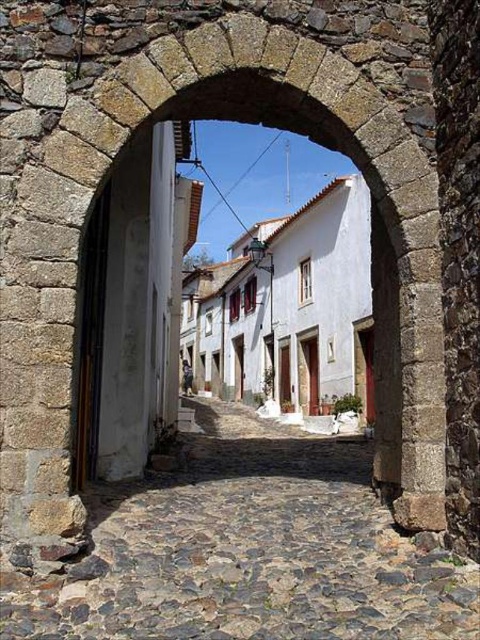
Question: Does cobblestone path at center lie behind white smooth building at center?

Choices:
 (A) no
 (B) yes

Answer: (A)

Question: Does cobblestone path at center have a smaller size compared to white smooth building at center?

Choices:
 (A) yes
 (B) no

Answer: (A)

Question: Which point appears closest to the camera in this image?

Choices:
 (A) (249, 529)
 (B) (328, 262)

Answer: (A)

Question: Which point is closer to the camera taking this photo?

Choices:
 (A) (360, 266)
 (B) (355, 496)

Answer: (B)

Question: Is cobblestone path at center above white smooth building at center?

Choices:
 (A) no
 (B) yes

Answer: (A)